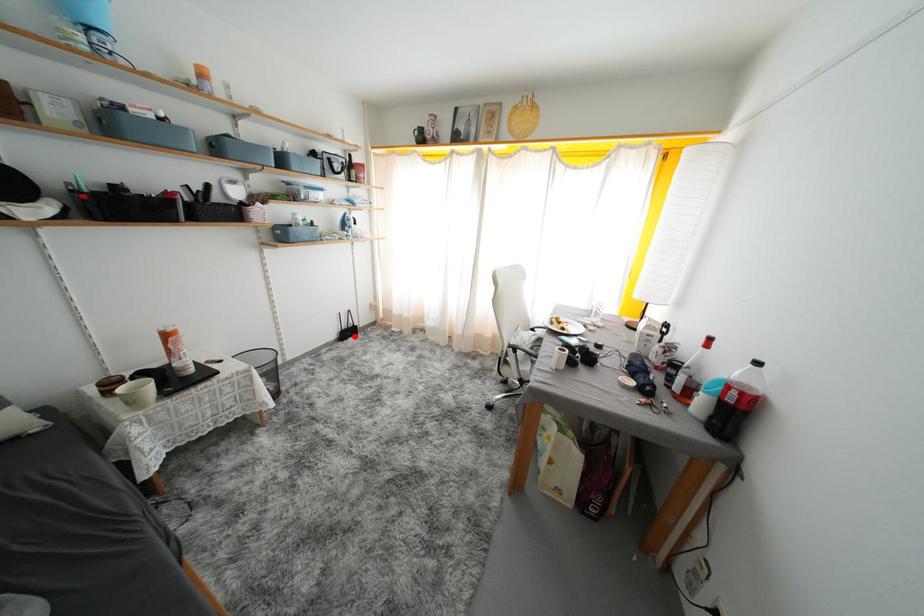
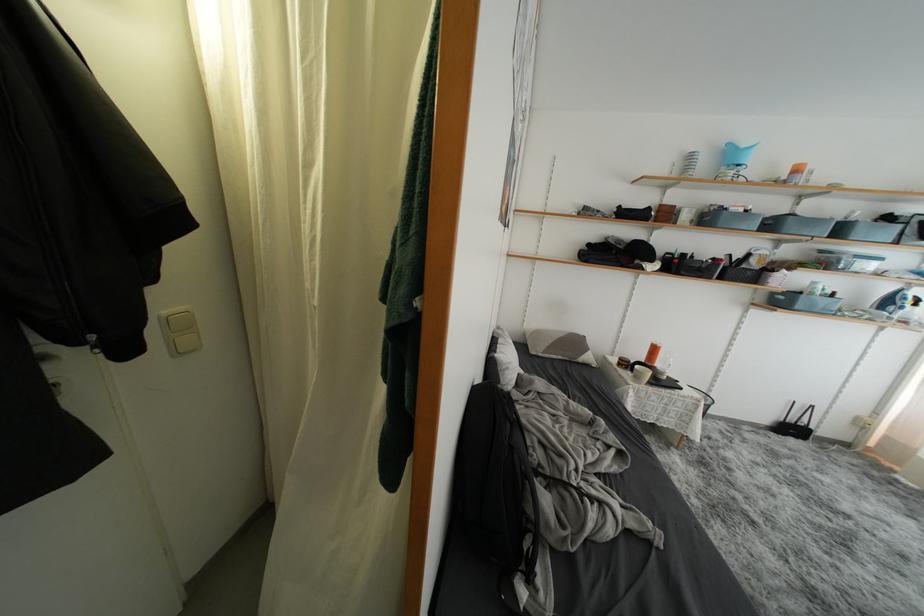
Question: I am providing you with two images of the same scene from different viewpoints. A red point is shown in image1. For the corresponding object point in image2, is it positioned nearer or farther from the camera?

Choices:
 (A) Nearer
 (B) Farther

Answer: (A)